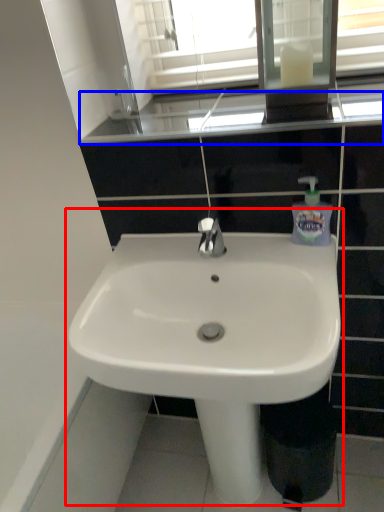
Question: Which object is further to the camera taking this photo, sink (highlighted by a red box) or window sill (highlighted by a blue box)?

Choices:
 (A) sink
 (B) window sill

Answer: (B)